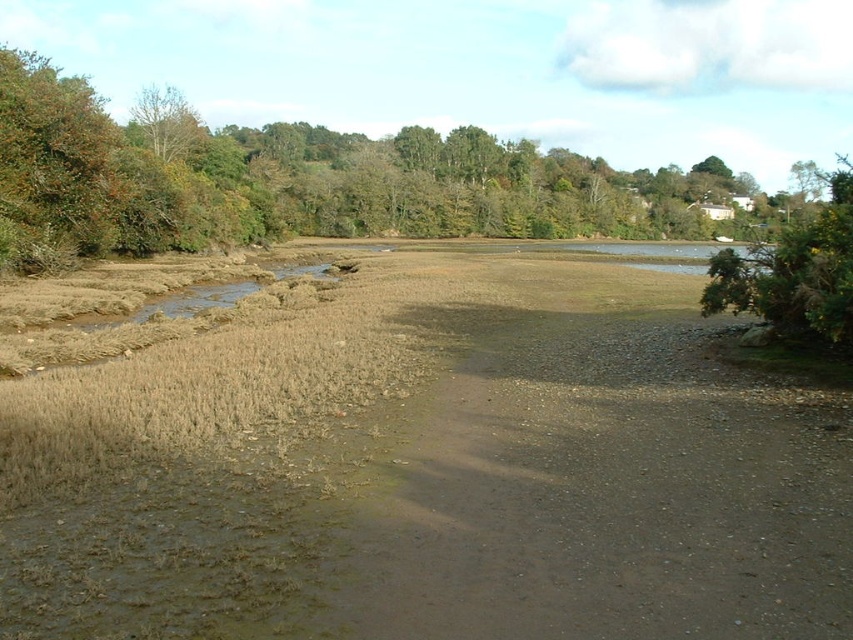
Question: Can you confirm if brown dirt track at center is positioned below green leafy tree at upper left?

Choices:
 (A) yes
 (B) no

Answer: (A)

Question: Which of the following is the farthest from the observer?

Choices:
 (A) (831, 246)
 (B) (165, 355)
 (C) (68, 186)

Answer: (C)

Question: Among these points, which one is farthest from the camera?

Choices:
 (A) (387, 230)
 (B) (722, 259)
 (C) (538, 588)

Answer: (A)

Question: Can you confirm if brown dirt track at center is bigger than green leafy bush at right?

Choices:
 (A) no
 (B) yes

Answer: (A)

Question: Which point appears closest to the camera in this image?

Choices:
 (A) (851, 273)
 (B) (285, 573)

Answer: (B)

Question: Does green leafy tree at upper left have a smaller size compared to green leafy bush at right?

Choices:
 (A) no
 (B) yes

Answer: (A)